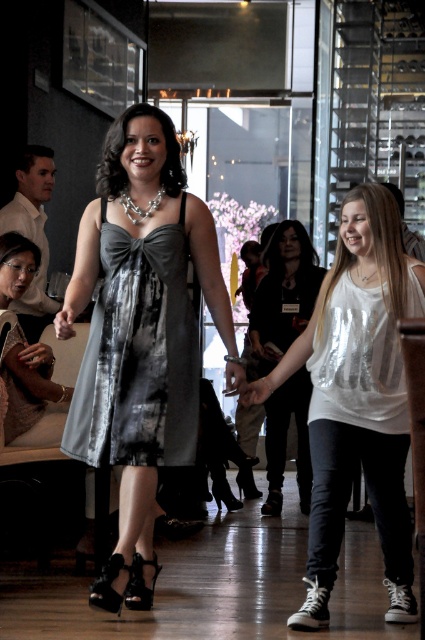
Question: Does shiny metallic dress at center appear on the left side of black leather jacket at center?

Choices:
 (A) no
 (B) yes

Answer: (B)

Question: Among these objects, which one is farthest from the camera?

Choices:
 (A) white matte shirt at center
 (B) black leather sandal at lower center

Answer: (B)

Question: Considering the real-world distances, which object is closest to the white matte shirt at center?

Choices:
 (A) matte black dress at center
 (B) shiny metallic dress at center
 (C) silky gray dress at center

Answer: (C)

Question: Among these objects, which one is farthest from the camera?

Choices:
 (A) black leather sandal at lower center
 (B) matte black dress at center
 (C) shiny metallic dress at center
 (D) black leather jacket at center

Answer: (D)

Question: Can you confirm if white matte shirt at center is bigger than black leather jacket at center?

Choices:
 (A) yes
 (B) no

Answer: (B)

Question: Does black leather jacket at center have a larger size compared to matte black dress at center?

Choices:
 (A) no
 (B) yes

Answer: (B)